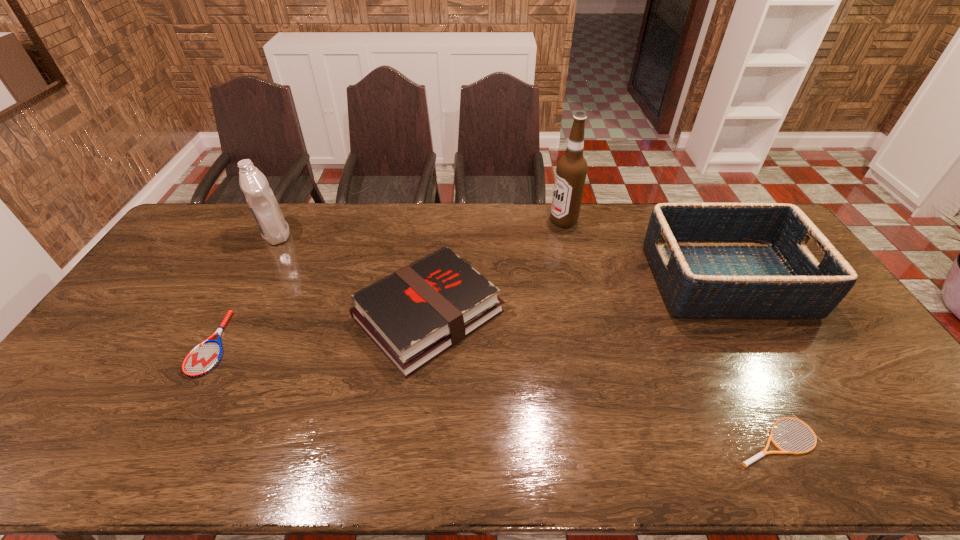
The image size is (960, 540). What are the coordinates of `alcohol` in the screenshot? It's located at (571, 170).

Locate an element on the screen. This screenshot has height=540, width=960. the tallest object is located at coordinates (571, 170).

Identify the location of the second tallest object. (264, 207).

Where is `basket`? basket is located at coordinates (711, 260).

Where is `the fourth object from right to left`? Image resolution: width=960 pixels, height=540 pixels. the fourth object from right to left is located at coordinates (415, 314).

Locate an element on the screen. Image resolution: width=960 pixels, height=540 pixels. hardback book is located at coordinates (415, 314).

I want to click on the left tennis racket, so click(202, 359).

I want to click on the farther tennis racket, so click(x=202, y=359).

You are a GUI agent. You are given a task and a screenshot of the screen. Output one action in this format:
    pyautogui.click(x=<x>, y=<y>)
    Task: Click on the nearer tennis racket
    
    Given the screenshot: What is the action you would take?
    pyautogui.click(x=761, y=454)

The width and height of the screenshot is (960, 540). What are the coordinates of `the nearest object` in the screenshot? It's located at (761, 454).